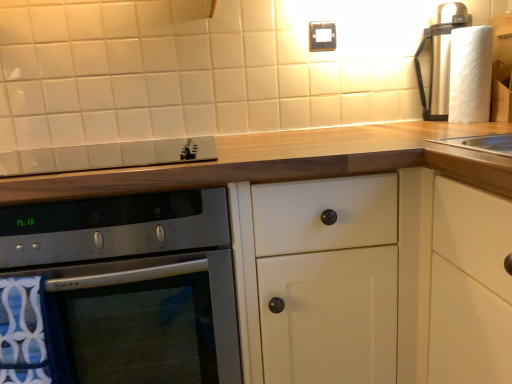
This screenshot has height=384, width=512. I want to click on gold metallic electric outlet at upper center, so click(322, 36).

In order to face satin silver gas stove at upper center, should I rotate leftwards or rightwards?

Rotate left and turn 20.659 degrees.

I want to click on gold metallic electric outlet at upper center, so click(322, 36).

Is satin silver gas stove at upper center positioned far away from white matte cabinet at center?

No, there isn't a large distance between satin silver gas stove at upper center and white matte cabinet at center.

Is satin silver gas stove at upper center not within white matte cabinet at center?

No, most part of satin silver gas stove at upper center lies within white matte cabinet at center.

Considering the points (87, 166) and (349, 157), which point is behind, point (87, 166) or point (349, 157)?

Point (87, 166)

From the image's perspective, which is above, satin silver gas stove at upper center or white matte cabinet at center?

satin silver gas stove at upper center is shown above in the image.

Is white textured paper towel at upper right far away from gold metallic electric outlet at upper center?

No, white textured paper towel at upper right is not far away from gold metallic electric outlet at upper center.

Can you confirm if white textured paper towel at upper right is taller than gold metallic electric outlet at upper center?

Yes.

Which is in front, point (468, 30) or point (311, 47)?

The point (468, 30) is more forward.

This screenshot has width=512, height=384. What are the coordinates of `electric outlet on the left of the white textured paper towel at upper right` in the screenshot? It's located at (322, 36).

The image size is (512, 384). What are the coordinates of `paper towel behind the white matte cabinet at center` in the screenshot? It's located at (470, 74).

Measure the distance from white textured paper towel at upper right to white matte cabinet at center.

white textured paper towel at upper right and white matte cabinet at center are 16.07 inches apart.

Could you tell me if white textured paper towel at upper right is turned towards white matte cabinet at center?

No, white textured paper towel at upper right is not aimed at white matte cabinet at center.

Is white textured paper towel at upper right at the left side of white matte cabinet at center?

In fact, white textured paper towel at upper right is to the right of white matte cabinet at center.

Can you confirm if satin silver gas stove at upper center is wider than satin silver oven at lower left?

No, satin silver gas stove at upper center is not wider than satin silver oven at lower left.

From the image's perspective, is satin silver gas stove at upper center above satin silver oven at lower left?

Yes, from the image's perspective, satin silver gas stove at upper center is on top of satin silver oven at lower left.

Does satin silver gas stove at upper center lie in front of satin silver oven at lower left?

No, satin silver gas stove at upper center is further to the viewer.

Consider the image. Between satin silver gas stove at upper center and white textured paper towel at upper right, which one appears on the left side from the viewer's perspective?

satin silver gas stove at upper center is more to the left.

From a real-world perspective, is satin silver gas stove at upper center positioned above or below white textured paper towel at upper right?

Clearly, from a real-world perspective, satin silver gas stove at upper center is below white textured paper towel at upper right.

Considering the sizes of objects satin silver gas stove at upper center and white textured paper towel at upper right in the image provided, who is shorter, satin silver gas stove at upper center or white textured paper towel at upper right?

Standing shorter between the two is satin silver gas stove at upper center.

Between point (54, 171) and point (489, 70), which one is positioned in front?

The point (489, 70) is closer.

Would you say satin silver oven at lower left contains white matte cabinet at center?

Indeed, white matte cabinet at center is located within satin silver oven at lower left.

Is point (56, 236) positioned before point (238, 141)?

Yes, point (56, 236) is closer to viewer.

From a real-world perspective, is satin silver oven at lower left over white matte cabinet at center?

Yes, from a real-world perspective, satin silver oven at lower left is above white matte cabinet at center.

Is point (94, 297) more distant than point (309, 44)?

No, it is in front of (309, 44).

Is satin silver oven at lower left positioned far away from gold metallic electric outlet at upper center?

satin silver oven at lower left is actually quite close to gold metallic electric outlet at upper center.

Which object is wider, satin silver oven at lower left or gold metallic electric outlet at upper center?

satin silver oven at lower left is wider.

How much distance is there between satin silver oven at lower left and gold metallic electric outlet at upper center?

36.32 inches.

At what (x,y) coordinates should I click in order to perform the action: click on gas stove above the white matte cabinet at center (from the image's perspective). Please return your answer as a coordinate pair (x, y). Looking at the image, I should click on (106, 156).

Where is `electric outlet that appears above the white textured paper towel at upper right (from a real-world perspective)`? This screenshot has height=384, width=512. electric outlet that appears above the white textured paper towel at upper right (from a real-world perspective) is located at coordinates (322, 36).

Which object lies nearer to the anchor point white textured paper towel at upper right, white matte cabinet at center or satin silver gas stove at upper center?

white matte cabinet at center lies closer to white textured paper towel at upper right than the other object.

When comparing their distances from gold metallic electric outlet at upper center, does white textured paper towel at upper right or satin silver gas stove at upper center seem further?

satin silver gas stove at upper center.

When comparing their distances from satin silver gas stove at upper center, does white textured paper towel at upper right or gold metallic electric outlet at upper center seem further?

white textured paper towel at upper right is further to satin silver gas stove at upper center.

Which object lies nearer to the anchor point white textured paper towel at upper right, satin silver gas stove at upper center or gold metallic electric outlet at upper center?

gold metallic electric outlet at upper center lies closer to white textured paper towel at upper right than the other object.

Estimate the real-world distances between objects in this image. Which object is further from white textured paper towel at upper right, white matte cabinet at center or gold metallic electric outlet at upper center?

Among the two, white matte cabinet at center is located further to white textured paper towel at upper right.

Estimate the real-world distances between objects in this image. Which object is further from white matte cabinet at center, white textured paper towel at upper right or satin silver oven at lower left?

Based on the image, white textured paper towel at upper right appears to be further to white matte cabinet at center.

Based on their spatial positions, is satin silver oven at lower left or gold metallic electric outlet at upper center closer to white textured paper towel at upper right?

gold metallic electric outlet at upper center is closer to white textured paper towel at upper right.

When comparing their distances from white matte cabinet at center, does gold metallic electric outlet at upper center or white textured paper towel at upper right seem closer?

white textured paper towel at upper right is positioned closer to the anchor white matte cabinet at center.

Locate an element on the screen. Image resolution: width=512 pixels, height=384 pixels. electric outlet between satin silver gas stove at upper center and white textured paper towel at upper right is located at coordinates (322, 36).

Where is `paper towel between gold metallic electric outlet at upper center and white matte cabinet at center from top to bottom`? paper towel between gold metallic electric outlet at upper center and white matte cabinet at center from top to bottom is located at coordinates (470, 74).

At what (x,y) coordinates should I click in order to perform the action: click on gas stove between gold metallic electric outlet at upper center and satin silver oven at lower left from top to bottom. Please return your answer as a coordinate pair (x, y). Image resolution: width=512 pixels, height=384 pixels. Looking at the image, I should click on coord(106,156).

The width and height of the screenshot is (512, 384). Identify the location of gas stove between gold metallic electric outlet at upper center and white matte cabinet at center from top to bottom. (106, 156).